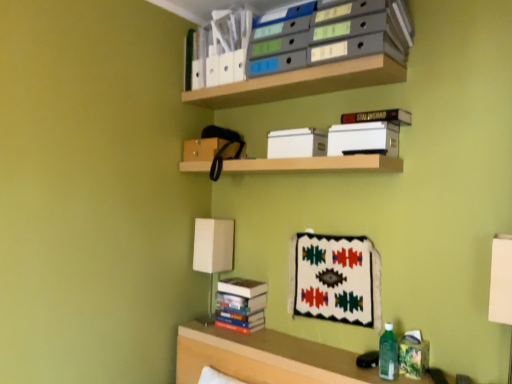
Question: Considering the relative sizes of hardcover book at upper center, placed as the 2th paperback book when sorted from right to left, and hardcover books at lower center, which ranks as the first book in bottom-to-top order, in the image provided, is hardcover book at upper center, placed as the 2th paperback book when sorted from right to left, taller than hardcover books at lower center, which ranks as the first book in bottom-to-top order,?

Choices:
 (A) yes
 (B) no

Answer: (B)

Question: Is hardcover books at lower center, acting as the 2th book starting from the top, surrounded by hardcover book at upper center, placed as the 2th paperback book when sorted from right to left?

Choices:
 (A) yes
 (B) no

Answer: (B)

Question: Does hardcover book at upper center, placed as the 2th paperback book when sorted from right to left, appear on the left side of hardcover books at lower center, which ranks as the first book in bottom-to-top order?

Choices:
 (A) no
 (B) yes

Answer: (A)

Question: Is hardcover books at lower center, acting as the 2th book starting from the top, at the back of hardcover book at upper center, acting as the 2th paperback book starting from the left?

Choices:
 (A) yes
 (B) no

Answer: (B)

Question: Is hardcover book at upper center, acting as the 2th paperback book starting from the left, at the right side of hardcover books at lower center, acting as the 2th book starting from the top?

Choices:
 (A) no
 (B) yes

Answer: (B)

Question: Is white matte paper at upper center, which is the first paperback book in left-to-right order, taller or shorter than wooden shelf at center, arranged as the 2th shelf when viewed from the top?

Choices:
 (A) short
 (B) tall

Answer: (B)

Question: In terms of width, does white matte paper at upper center, which appears as the 3th paperback book when viewed from the right, look wider or thinner when compared to wooden shelf at center, the 2th shelf in the bottom-to-top sequence?

Choices:
 (A) wide
 (B) thin

Answer: (B)

Question: From a real-world perspective, is white matte paper at upper center, which appears as the 3th paperback book when viewed from the right, physically located above or below wooden shelf at center, arranged as the 2th shelf when viewed from the top?

Choices:
 (A) above
 (B) below

Answer: (A)

Question: Considering the positions of point tap(306, 147) and point tap(283, 167), is point tap(306, 147) closer or farther from the camera than point tap(283, 167)?

Choices:
 (A) closer
 (B) farther

Answer: (B)

Question: Based on their sizes in the image, would you say hardcover book at upper center, which is the 1th paperback book from right to left, is bigger or smaller than hardcover book at upper center, placed as the 2th paperback book when sorted from right to left?

Choices:
 (A) big
 (B) small

Answer: (B)

Question: Looking at their shapes, would you say hardcover book at upper center, which is the 1th paperback book from right to left, is wider or thinner than hardcover book at upper center, placed as the 2th paperback book when sorted from right to left?

Choices:
 (A) thin
 (B) wide

Answer: (A)

Question: Considering their positions, is hardcover book at upper center, which is the 1th paperback book from right to left, located in front of or behind hardcover book at upper center, placed as the 2th paperback book when sorted from right to left?

Choices:
 (A) behind
 (B) front

Answer: (A)

Question: Is hardcover book at upper center, which is the 1th paperback book from right to left, situated inside hardcover book at upper center, acting as the 2th paperback book starting from the left, or outside?

Choices:
 (A) inside
 (B) outside

Answer: (A)

Question: From a real-world perspective, is white matte paper at upper center, which is the first paperback book in left-to-right order, physically located above or below white matte file folder at upper center, the first book positioned from the top?

Choices:
 (A) above
 (B) below

Answer: (B)

Question: Is white matte paper at upper center, which appears as the 3th paperback book when viewed from the right, taller or shorter than white matte file folder at upper center, which ranks as the second book in bottom-to-top order?

Choices:
 (A) tall
 (B) short

Answer: (B)